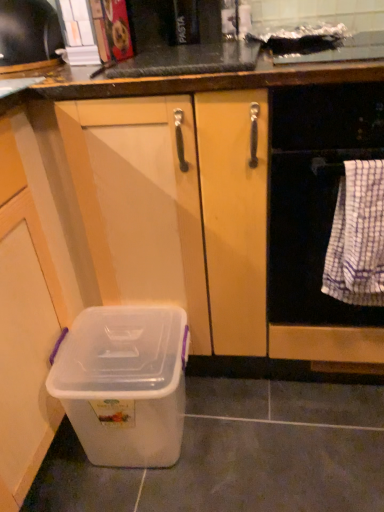
Question: Is metallic silver toaster at upper left positioned before transparent plastic storage box at lower left?

Choices:
 (A) yes
 (B) no

Answer: (B)

Question: Is metallic silver toaster at upper left positioned behind transparent plastic storage box at lower left?

Choices:
 (A) no
 (B) yes

Answer: (B)

Question: From the image's perspective, is metallic silver toaster at upper left located beneath transparent plastic storage box at lower left?

Choices:
 (A) yes
 (B) no

Answer: (B)

Question: Considering the relative sizes of metallic silver toaster at upper left and transparent plastic storage box at lower left in the image provided, is metallic silver toaster at upper left shorter than transparent plastic storage box at lower left?

Choices:
 (A) yes
 (B) no

Answer: (A)

Question: Considering the relative sizes of metallic silver toaster at upper left and transparent plastic storage box at lower left in the image provided, is metallic silver toaster at upper left smaller than transparent plastic storage box at lower left?

Choices:
 (A) no
 (B) yes

Answer: (B)

Question: Is point (33, 30) positioned closer to the camera than point (342, 268)?

Choices:
 (A) farther
 (B) closer

Answer: (A)

Question: Based on their positions, is metallic silver toaster at upper left located to the left or right of white checkered towel at right?

Choices:
 (A) right
 (B) left

Answer: (B)

Question: Considering the positions of metallic silver toaster at upper left and white checkered towel at right in the image, is metallic silver toaster at upper left taller or shorter than white checkered towel at right?

Choices:
 (A) tall
 (B) short

Answer: (B)

Question: In terms of width, does metallic silver toaster at upper left look wider or thinner when compared to white checkered towel at right?

Choices:
 (A) thin
 (B) wide

Answer: (B)

Question: Considering their positions, is white checkered towel at right located in front of or behind metallic silver toaster at upper left?

Choices:
 (A) behind
 (B) front

Answer: (B)

Question: In the image, is white checkered towel at right on the left side or the right side of metallic silver toaster at upper left?

Choices:
 (A) left
 (B) right

Answer: (B)

Question: From their relative heights in the image, would you say white checkered towel at right is taller or shorter than metallic silver toaster at upper left?

Choices:
 (A) short
 (B) tall

Answer: (B)

Question: Is white checkered towel at right wider or thinner than metallic silver toaster at upper left?

Choices:
 (A) thin
 (B) wide

Answer: (A)

Question: Is white checkered towel at right in front of or behind white woven towel at right in the image?

Choices:
 (A) behind
 (B) front

Answer: (A)

Question: From a real-world perspective, is white checkered towel at right above or below white woven towel at right?

Choices:
 (A) above
 (B) below

Answer: (B)